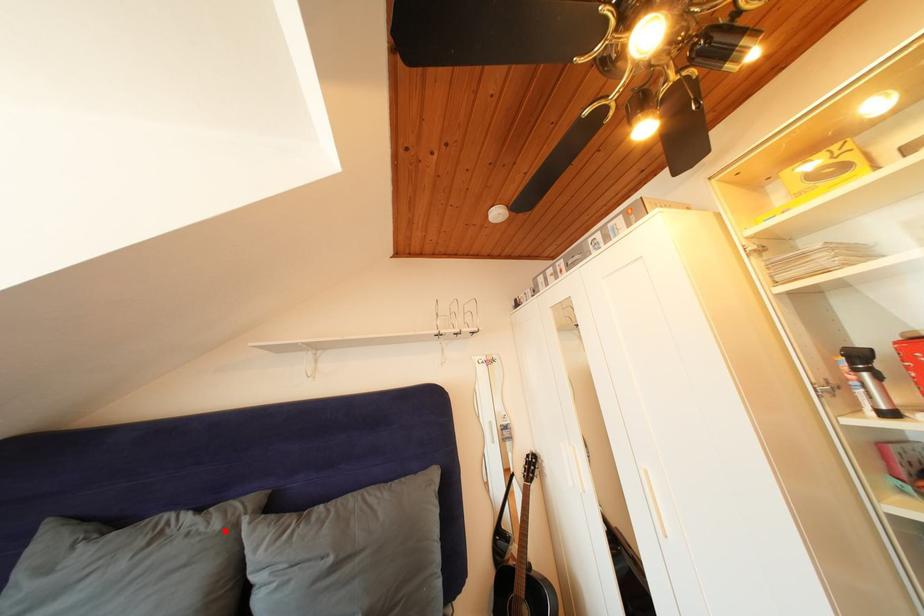
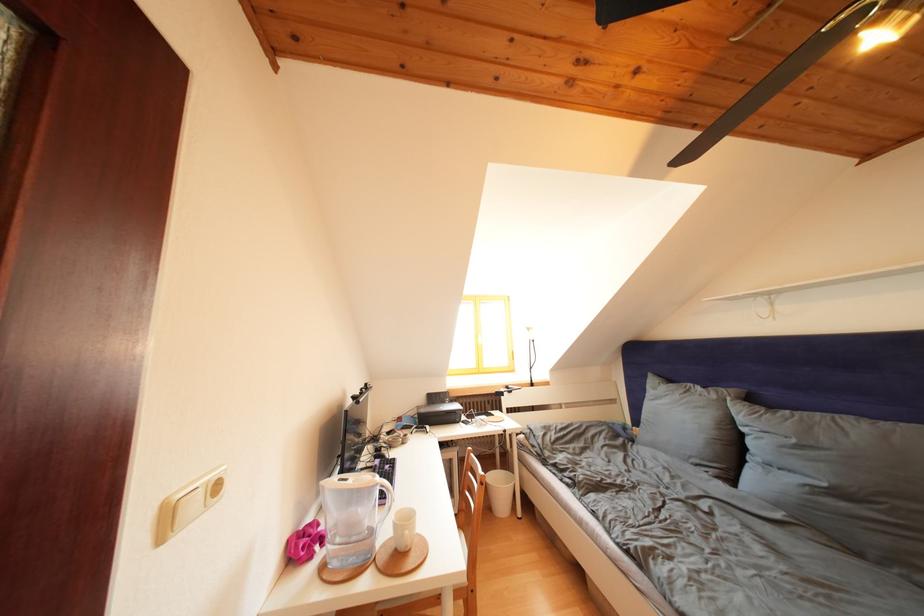
Where in the second image is the point corresponding to the highlighted location from the first image?

(722, 402)